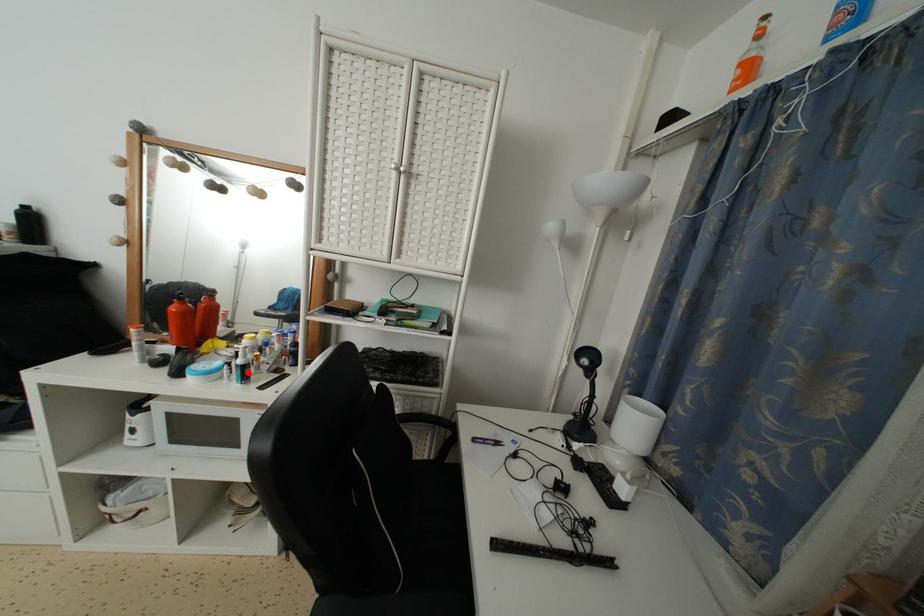
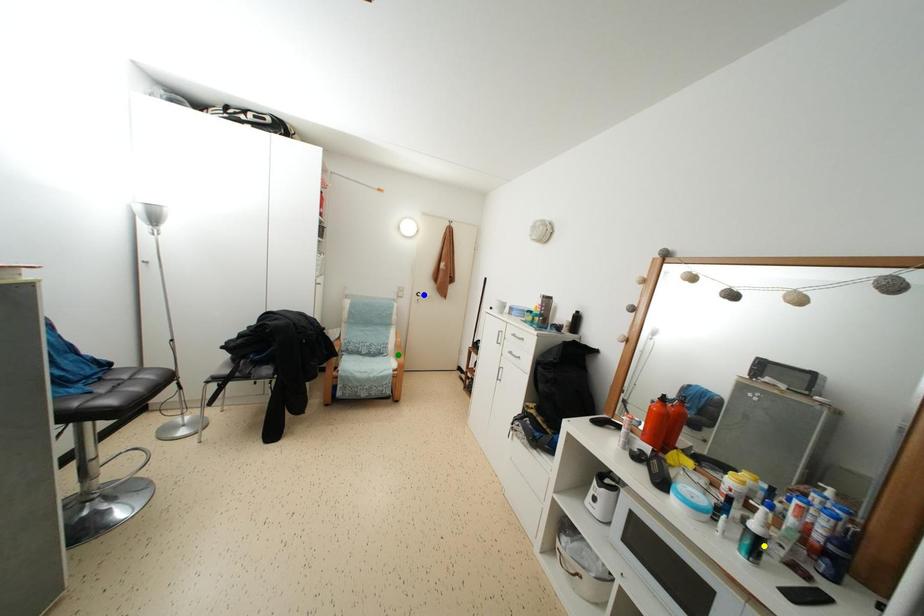
Question: I am providing you with two images of the same scene from different viewpoints. A red point is marked on the first image. You are given multiple points on the second image. In image 2, which mark is for the same physical point as the one in image 1?

Choices:
 (A) yellow point
 (B) blue point
 (C) green point

Answer: (A)